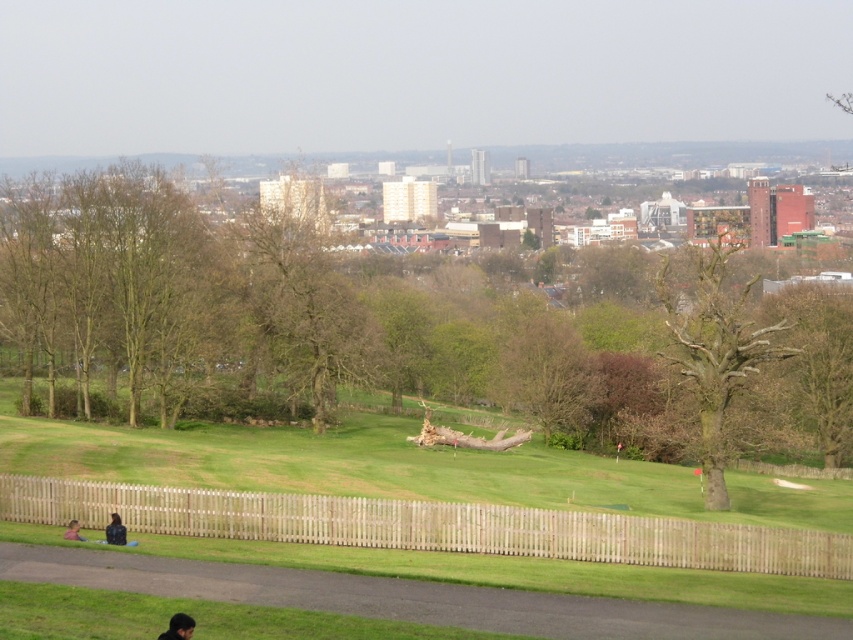
Based on the photo, is green grass at center shorter than dark brown hair at lower left?

No.

Between green grass at center and dark brown hair at lower left, which one is positioned higher?

dark brown hair at lower left is above.

The width and height of the screenshot is (853, 640). Find the location of `green grass at center`. green grass at center is located at coordinates (396, 468).

Between brown wood tree at center and dark blue jacket at lower left, which one is positioned lower?

dark blue jacket at lower left

Which of these two, brown wood tree at center or dark blue jacket at lower left, stands shorter?

dark blue jacket at lower left is shorter.

Where is `brown wood tree at center`? The width and height of the screenshot is (853, 640). brown wood tree at center is located at coordinates (364, 332).

Measure the distance between point (x=718, y=348) and camera.

Point (x=718, y=348) and camera are 71.00 meters apart from each other.

Can you confirm if brown rough textured tree at right is thinner than dark brown hair at lower left?

In fact, brown rough textured tree at right might be wider than dark brown hair at lower left.

Describe the element at coordinates (715, 348) in the screenshot. I see `brown rough textured tree at right` at that location.

You are a GUI agent. You are given a task and a screenshot of the screen. Output one action in this format:
    pyautogui.click(x=<x>, y=<y>)
    Task: Click on the brown rough textured tree at right
    
    Given the screenshot: What is the action you would take?
    pyautogui.click(x=715, y=348)